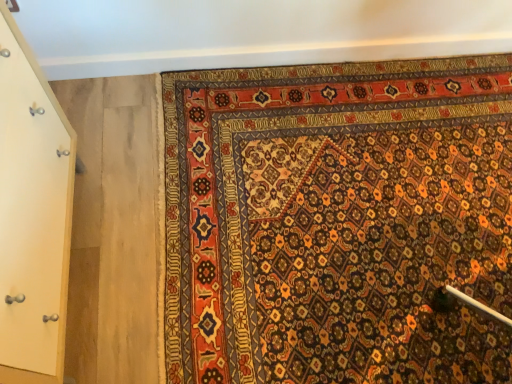
Find the location of `free space between light wood door at left and carpet with intricate patterns at lower right`. free space between light wood door at left and carpet with intricate patterns at lower right is located at coordinates (122, 214).